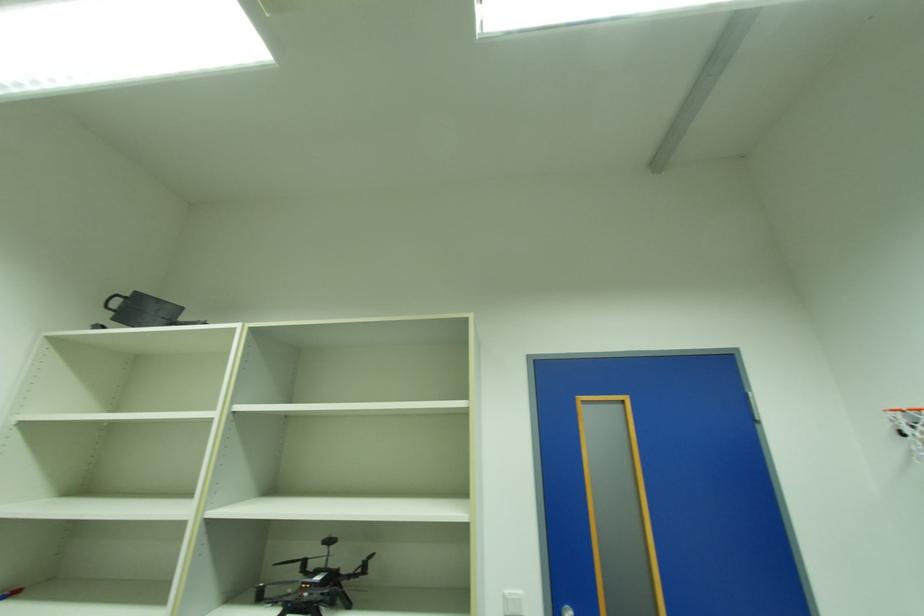
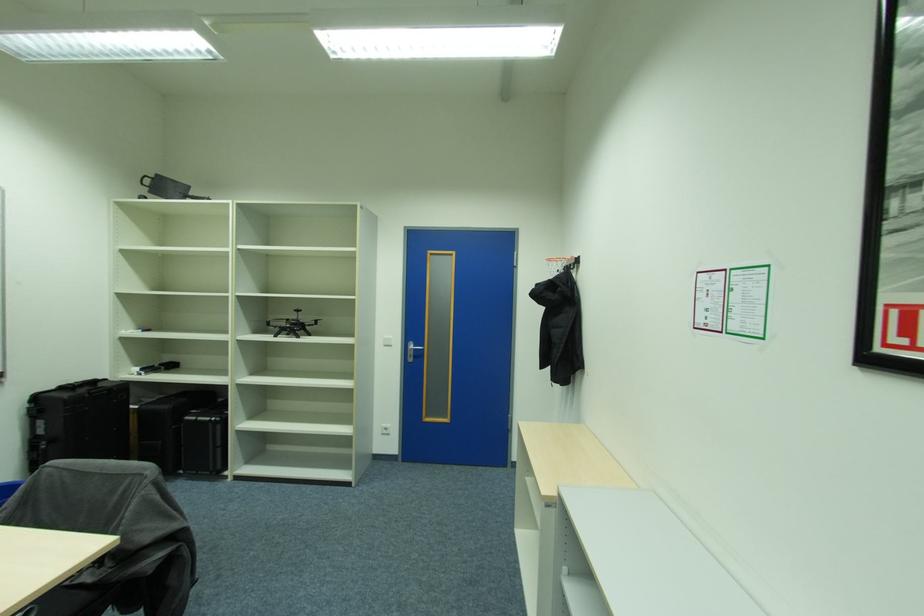
In a continuous first-person perspective shot, in which direction is the camera moving?

The cameraman moved toward right, backward.